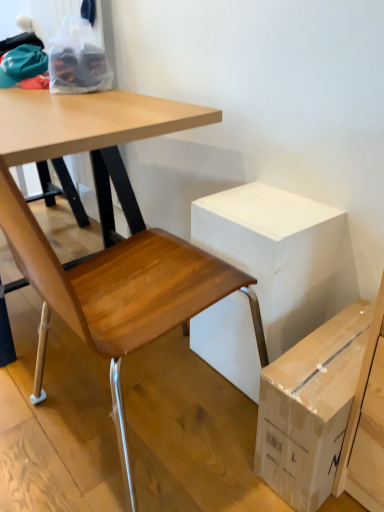
At what (x,y) coordinates should I click in order to perform the action: click on vacant region to the left of brown cardboard box at lower right. Please return your answer as a coordinate pair (x, y). Looking at the image, I should click on (197, 435).